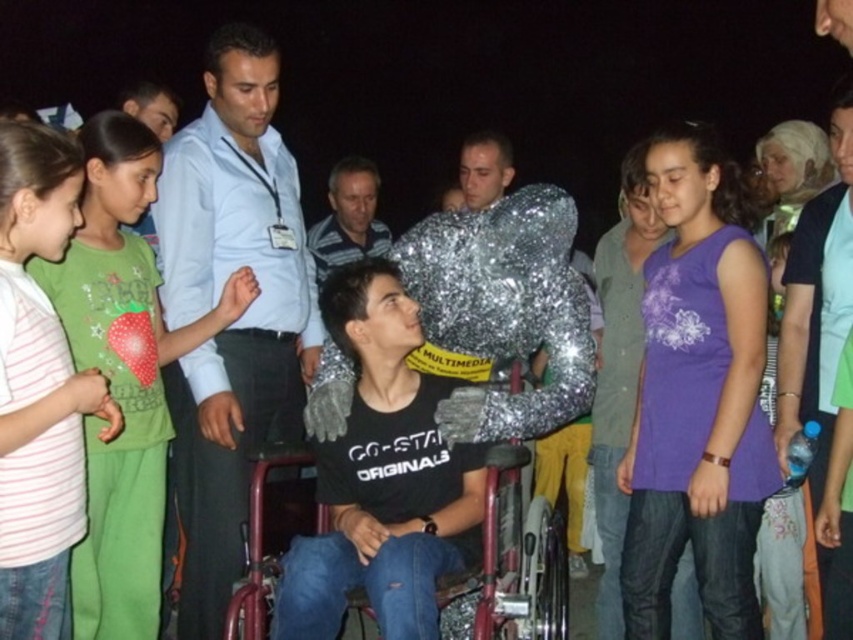
You are a photographer at the event and want to capture the group around the wheelchair. You need to ensure the green matte shirt at left is in the frame. Where should you position your camera relative to the wheelchair?

The green matte shirt at left is located at point (123,376), so position the camera slightly to the left and lower down to include them in the frame.

Based on the scene description, can you determine the spatial relationship between the striped cotton shirt at left and the metallic red wheelchair at center?

The striped cotton shirt at left is positioned to the left of the metallic red wheelchair at center.